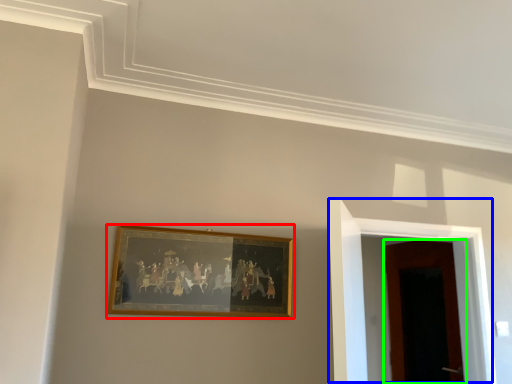
Question: Considering the real-world distances, which object is closest to picture frame (highlighted by a red box)? door (highlighted by a blue box) or door (highlighted by a green box).

Choices:
 (A) door
 (B) door

Answer: (A)